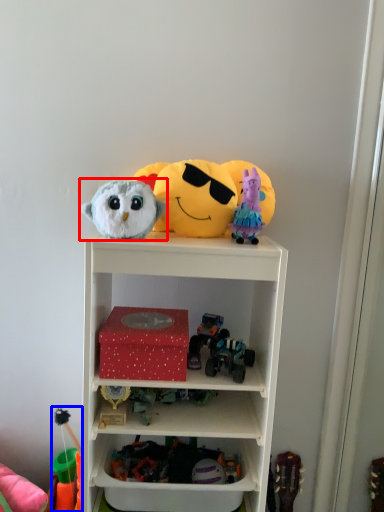
Question: Which object appears farthest to the camera in this image, toy (highlighted by a red box) or toy (highlighted by a blue box)?

Choices:
 (A) toy
 (B) toy

Answer: (B)